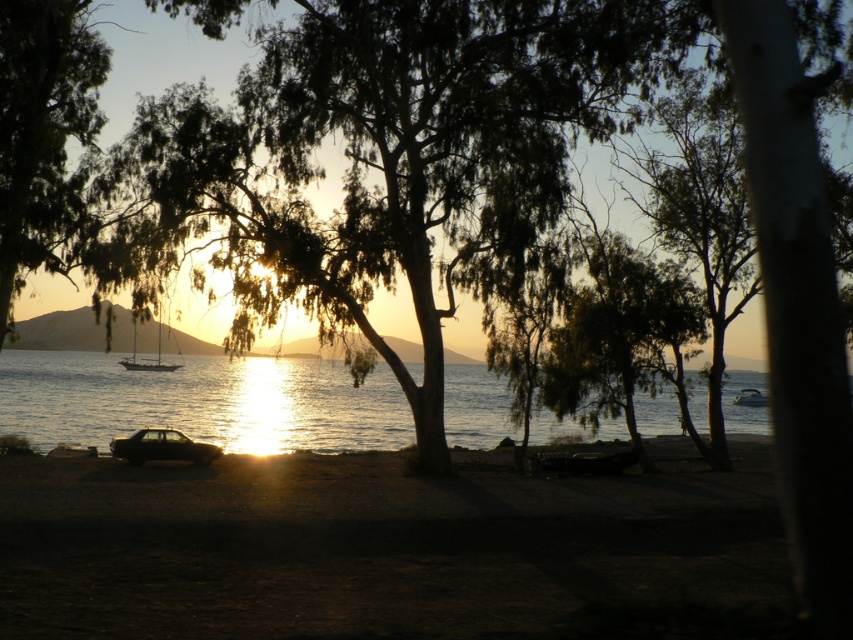
Which is more to the right, dark sand at lower center or green leafy tree at center?

Positioned to the right is dark sand at lower center.

Is dark sand at lower center to the left of green leafy tree at center from the viewer's perspective?

No, dark sand at lower center is not to the left of green leafy tree at center.

Who is more distant from viewer, (341, 582) or (62, 131)?

The point (62, 131) is behind.

The image size is (853, 640). In order to click on dark sand at lower center in this screenshot , I will do `click(387, 548)`.

Based on the photo, is green leafy tree at center further to camera compared to glistening water at center?

No.

Is green leafy tree at center smaller than glistening water at center?

Incorrect, green leafy tree at center is not smaller in size than glistening water at center.

Where is `green leafy tree at center`? green leafy tree at center is located at coordinates (450, 115).

Is green leafy tree at center positioned before shiny silver sailboat at center?

That is True.

Is green leafy tree at center to the left of shiny silver sailboat at center from the viewer's perspective?

No, green leafy tree at center is not to the left of shiny silver sailboat at center.

Between point (540, 3) and point (160, 360), which one is positioned in front?

Point (540, 3) is more forward.

Locate an element on the screen. This screenshot has height=640, width=853. green leafy tree at center is located at coordinates (450, 115).